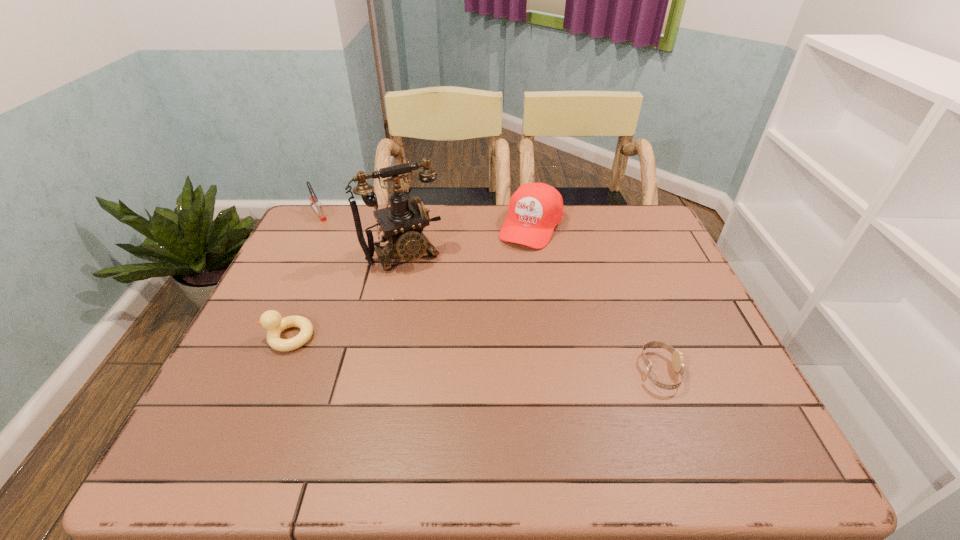
You are a GUI agent. You are given a task and a screenshot of the screen. Output one action in this format:
    pyautogui.click(x=<x>, y=<y>)
    Task: Click on the vacant space on the desktop that is between the second shortest object and the watch and is positioned on the rotary dial of the third object from right to left
    The image size is (960, 540).
    Given the screenshot: What is the action you would take?
    pyautogui.click(x=462, y=353)

Identify the location of vacant spot on the desktop that is between the duckling and the rightmost object and is positioned on the front panel of the baseball cap. (454, 352).

This screenshot has width=960, height=540. I want to click on free space on the desktop that is between the second shortest object and the watch and is positioned on the handle side of the third tallest object, so click(x=419, y=349).